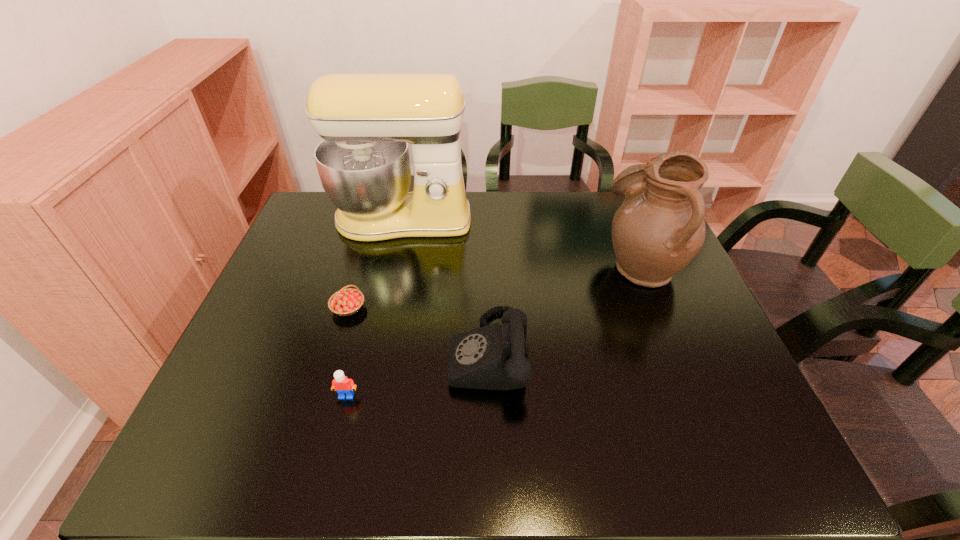
Find the location of a particular element. The width and height of the screenshot is (960, 540). object that is positioned at the far right corner is located at coordinates (659, 228).

Find the location of a particular element. This screenshot has height=540, width=960. vacant space at the far edge is located at coordinates (587, 212).

At what (x,y) coordinates should I click in order to perform the action: click on free space at the near edge of the desktop. Please return your answer as a coordinate pair (x, y). Image resolution: width=960 pixels, height=540 pixels. Looking at the image, I should click on (268, 467).

I want to click on vacant point at the left edge, so click(283, 366).

Locate an element on the screen. Image resolution: width=960 pixels, height=540 pixels. vacant space at the right edge of the desktop is located at coordinates (731, 369).

Find the location of a particular element. The width and height of the screenshot is (960, 540). empty space between the mixer and the fourth shortest object is located at coordinates (522, 242).

Where is `vacant space that is in between the second tallest object and the shortest object`? The height and width of the screenshot is (540, 960). vacant space that is in between the second tallest object and the shortest object is located at coordinates (495, 286).

At what (x,y) coordinates should I click in order to perform the action: click on free spot between the Lego and the strawberry. Please return your answer as a coordinate pair (x, y). Image resolution: width=960 pixels, height=540 pixels. Looking at the image, I should click on (348, 352).

Locate an element on the screen. Image resolution: width=960 pixels, height=540 pixels. free space that is in between the shortest object and the third shortest object is located at coordinates (419, 330).

Where is `vacant area that lies between the fourth shortest object and the mixer`? vacant area that lies between the fourth shortest object and the mixer is located at coordinates (522, 242).